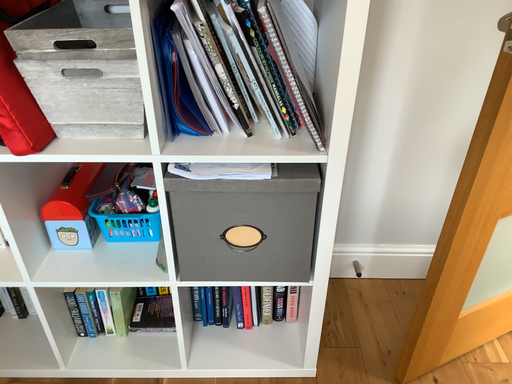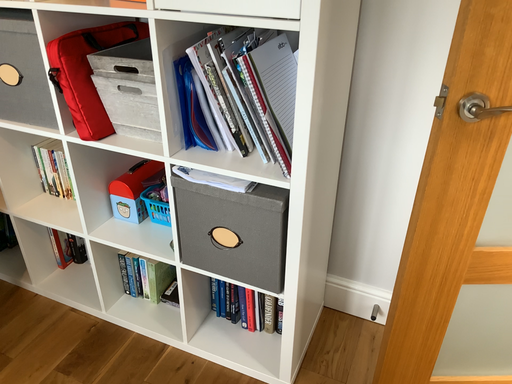
Question: How did the camera likely rotate when shooting the video?

Choices:
 (A) rotated right
 (B) rotated left

Answer: (B)